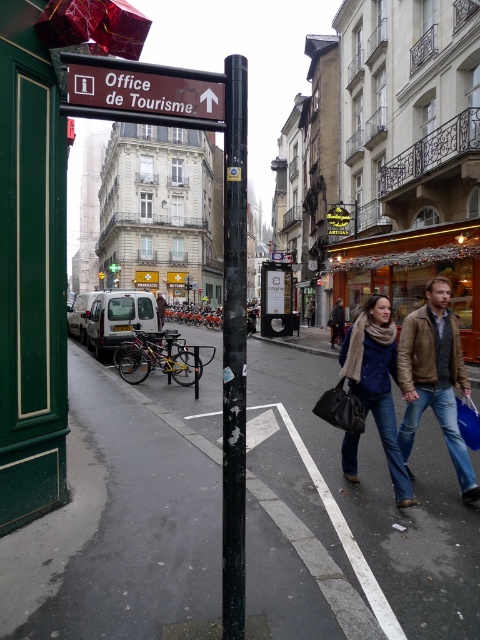
As a tourist standing at the point marked by the black pole with the red tourist office sign, which is on the left side of the frame, you want to walk towards the black asphalt pavement at lower center located at point (x=348, y=522). In which direction should you head?

You should head towards the direction of the lower center since the black asphalt pavement at lower center is located at point (x=348, y=522), which is in the lower center area of the frame.

You are a tourist in France and see the black asphalt pavement at lower center and the black matte pole at center. Which object is closer to your right side when facing the street?

The black asphalt pavement at lower center is to the right of the black matte pole at center, so when facing the street, the black asphalt pavement at lower center is closer to your right side.

You are a tourist trying to find the tourist office. You see the blue denim jeans at lower right and the brown wooden sign at upper center. Which object is closer to you?

The blue denim jeans at lower right are closer to you than the brown wooden sign at upper center because the brown wooden sign at upper center is behind the blue denim jeans at lower right.